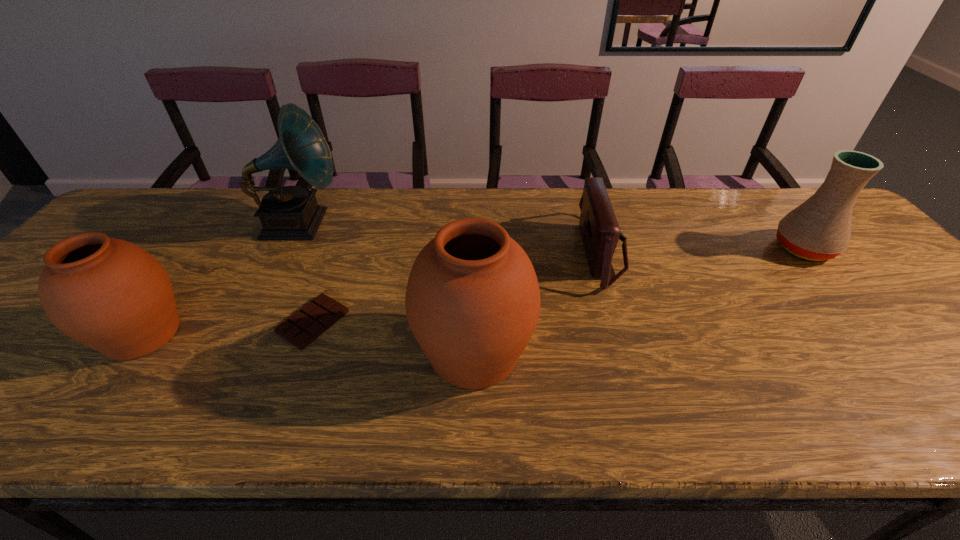
In the current image, all urns are evenly spaced. To maintain this equal spacing, where should an additional urn be placed on the right? Please point out a free spot. Please provide its 2D coordinates. Your answer should be formatted as a tuple, i.e. [(x, y)], where the tuple contains the x and y coordinates of a point satisfying the conditions above.

[(832, 374)]